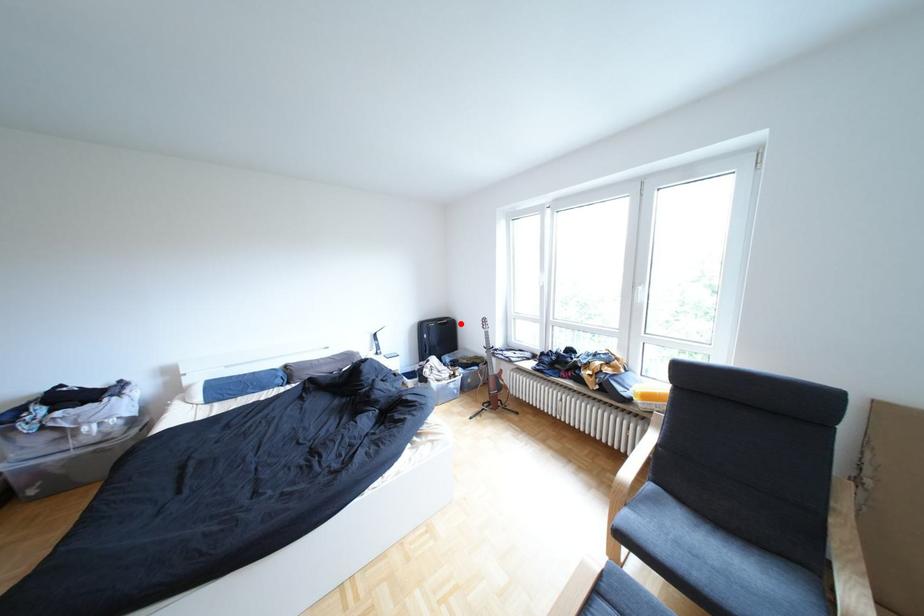
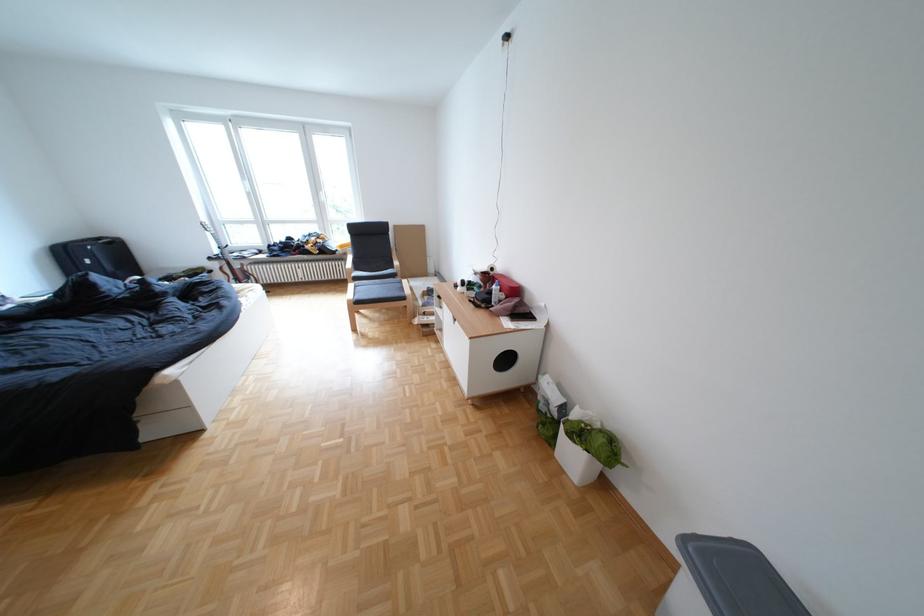
Find the pixel in the second image that matches the highlighted location in the first image.

(126, 244)